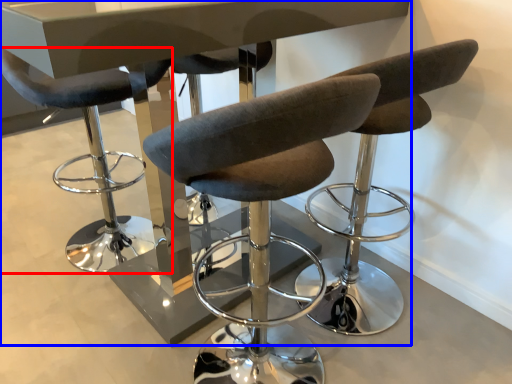
Question: Which object is closer to the camera taking this photo, chair (highlighted by a red box) or table (highlighted by a blue box)?

Choices:
 (A) chair
 (B) table

Answer: (B)